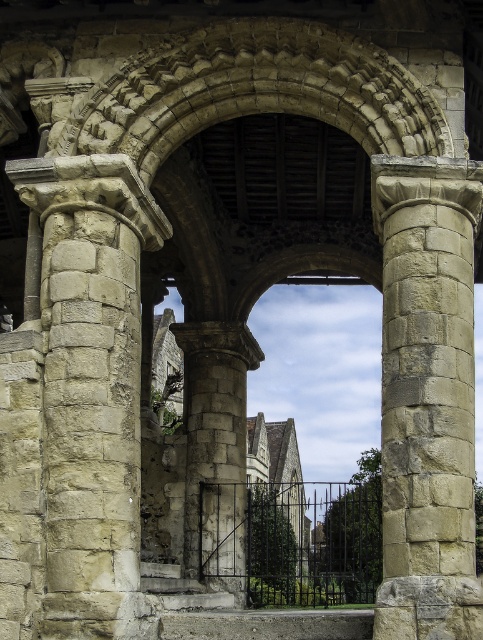
Between point (28, 609) and point (397, 509), which one is positioned behind?

The point (28, 609) is behind.

Which is more to the left, stone textured column at left or beige stone column at center?

From the viewer's perspective, stone textured column at left appears more on the left side.

Who is more forward, (110, 397) or (398, 289)?

Point (110, 397)

Locate an element on the screen. stone textured column at left is located at coordinates (76, 406).

Does point (31, 588) come behind point (213, 435)?

No, (31, 588) is in front of (213, 435).

Between stone textured column at left and gray stone pillar at center, which one has less height?

gray stone pillar at center is shorter.

What do you see at coordinates (76, 406) in the screenshot? I see `stone textured column at left` at bounding box center [76, 406].

Find the location of `stone textured column at left`. stone textured column at left is located at coordinates (76, 406).

In the scene shown: Is beige stone column at center to the left of gray stone pillar at center from the viewer's perspective?

Incorrect, beige stone column at center is not on the left side of gray stone pillar at center.

Is point (448, 477) farther from viewer compared to point (211, 412)?

No, it is not.

Identify the location of beige stone column at center. The height and width of the screenshot is (640, 483). (427, 396).

You are a GUI agent. You are given a task and a screenshot of the screen. Output one action in this format:
    pyautogui.click(x=<x>, y=<y>)
    Task: Click on the beige stone column at center
    
    Given the screenshot: What is the action you would take?
    (427, 396)